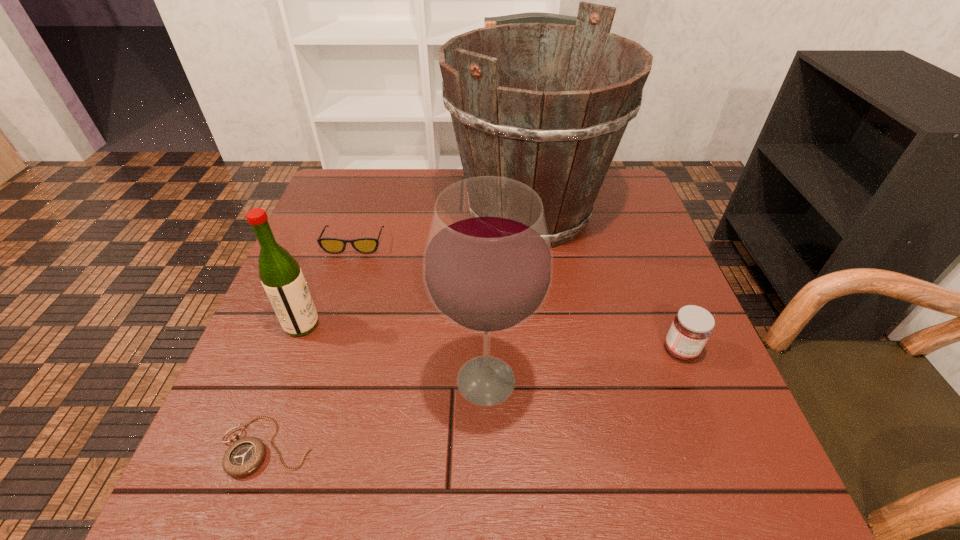
Identify the location of object that is positioned at the near left corner. (245, 455).

The image size is (960, 540). I want to click on object present at the far right corner, so click(x=560, y=138).

In order to click on vacant region at the far edge of the desktop in this screenshot , I will do `click(425, 185)`.

In the image, there is a desktop. At what (x,y) coordinates should I click in order to perform the action: click on free space at the near edge. Please return your answer as a coordinate pair (x, y). The image size is (960, 540). Looking at the image, I should click on (558, 480).

Identify the location of free space at the left edge of the desktop. (281, 419).

Identify the location of vacant space at the right edge of the desktop. (666, 274).

At what (x,y) coordinates should I click in order to perform the action: click on blank space at the far left corner. Please return your answer as a coordinate pair (x, y). Looking at the image, I should click on (344, 190).

In the image, there is a desktop. Where is `vacant space at the near left corner`? The width and height of the screenshot is (960, 540). vacant space at the near left corner is located at coordinates (205, 461).

Find the location of a particular element. This screenshot has height=540, width=960. free space at the far right corner of the desktop is located at coordinates (612, 201).

Find the location of `vacant area at the near right corner of the desktop`. vacant area at the near right corner of the desktop is located at coordinates [x=718, y=487].